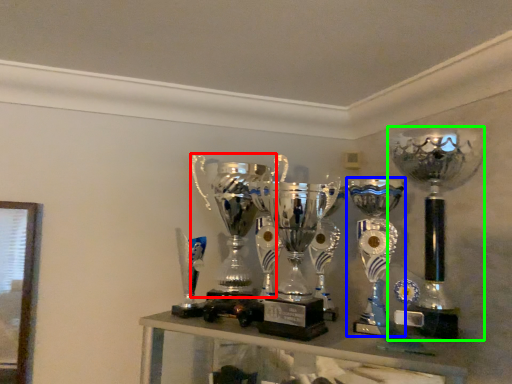
Question: Which object is the closest to the trophy (highlighted by a red box)? Choose among these: trophy (highlighted by a blue box) or trophy (highlighted by a green box).

Choices:
 (A) trophy
 (B) trophy

Answer: (A)